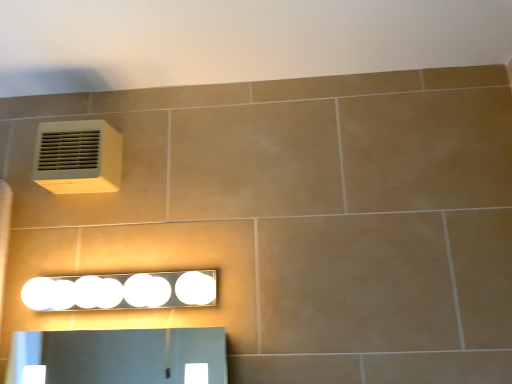
Question: From the image's perspective, is white plastic air conditioning unit at upper left over white glossy light fixture at lower center?

Choices:
 (A) yes
 (B) no

Answer: (A)

Question: Is white plastic air conditioning unit at upper left aimed at white glossy light fixture at lower center?

Choices:
 (A) yes
 (B) no

Answer: (B)

Question: Is white plastic air conditioning unit at upper left smaller than white glossy light fixture at lower center?

Choices:
 (A) yes
 (B) no

Answer: (A)

Question: Does white plastic air conditioning unit at upper left have a lesser height compared to white glossy light fixture at lower center?

Choices:
 (A) yes
 (B) no

Answer: (B)

Question: Considering the relative positions of white plastic air conditioning unit at upper left and white glossy light fixture at lower center in the image provided, is white plastic air conditioning unit at upper left to the right of white glossy light fixture at lower center from the viewer's perspective?

Choices:
 (A) yes
 (B) no

Answer: (B)

Question: From a real-world perspective, is white glossy light fixture at lower center positioned above or below beige tile at upper center?

Choices:
 (A) below
 (B) above

Answer: (A)

Question: Is white glossy light fixture at lower center inside the boundaries of beige tile at upper center, or outside?

Choices:
 (A) inside
 (B) outside

Answer: (B)

Question: Considering their positions, is white glossy light fixture at lower center located in front of or behind beige tile at upper center?

Choices:
 (A) behind
 (B) front

Answer: (A)

Question: Is white glossy light fixture at lower center bigger or smaller than beige tile at upper center?

Choices:
 (A) big
 (B) small

Answer: (B)

Question: Considering the positions of beige tile at upper center and white plastic air conditioning unit at upper left in the image, is beige tile at upper center taller or shorter than white plastic air conditioning unit at upper left?

Choices:
 (A) short
 (B) tall

Answer: (A)

Question: From a real-world perspective, is beige tile at upper center positioned above or below white plastic air conditioning unit at upper left?

Choices:
 (A) below
 (B) above

Answer: (B)

Question: Looking at the image, does beige tile at upper center seem bigger or smaller compared to white plastic air conditioning unit at upper left?

Choices:
 (A) big
 (B) small

Answer: (A)

Question: In the image, is beige tile at upper center on the left side or the right side of white plastic air conditioning unit at upper left?

Choices:
 (A) right
 (B) left

Answer: (A)

Question: Is white plastic air conditioning unit at upper left bigger or smaller than beige tile at upper center?

Choices:
 (A) big
 (B) small

Answer: (B)

Question: From a real-world perspective, is white plastic air conditioning unit at upper left positioned above or below beige tile at upper center?

Choices:
 (A) above
 (B) below

Answer: (B)